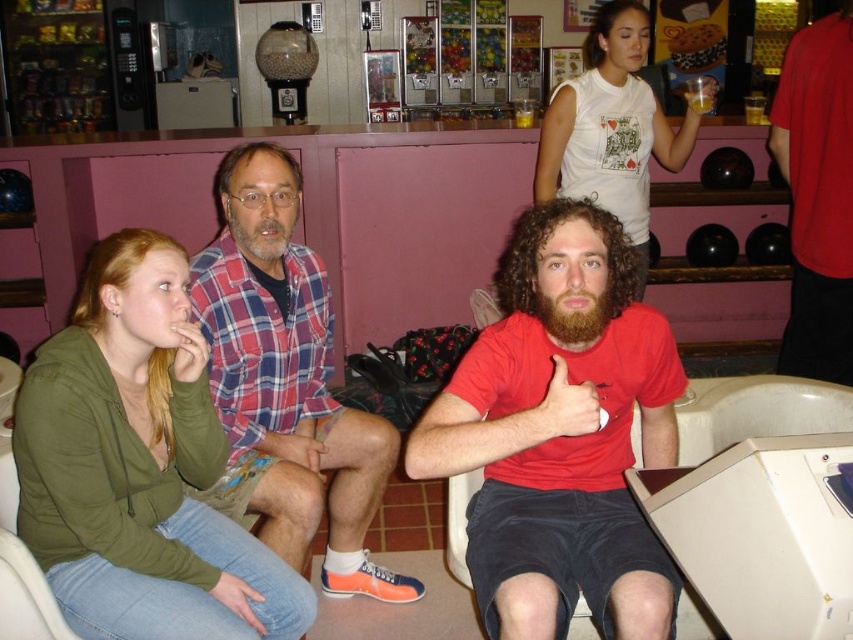
Which is more to the left, matte green hoodie at lower left or white cotton t-shirt at upper center?

matte green hoodie at lower left is more to the left.

Does matte green hoodie at lower left have a lesser height compared to white cotton t-shirt at upper center?

Correct, matte green hoodie at lower left is not as tall as white cotton t-shirt at upper center.

Between point (115, 296) and point (553, 182), which one is positioned behind?

Positioned behind is point (553, 182).

Identify the location of matte green hoodie at lower left. The height and width of the screenshot is (640, 853). (138, 467).

Who is more distant from viewer, (x=286, y=385) or (x=654, y=113)?

The point (x=654, y=113) is behind.

Between plaid shirt at center and white cotton t-shirt at upper center, which one is positioned lower?

plaid shirt at center

Find the location of a particular element. plaid shirt at center is located at coordinates (286, 384).

Looking at this image, can you confirm if red matte t-shirt at center is wider than matte green hoodie at lower left?

Yes, red matte t-shirt at center is wider than matte green hoodie at lower left.

In the scene shown: Does red matte t-shirt at center have a larger size compared to matte green hoodie at lower left?

Correct, red matte t-shirt at center is larger in size than matte green hoodie at lower left.

Where is `red matte t-shirt at center`? The height and width of the screenshot is (640, 853). red matte t-shirt at center is located at coordinates (561, 435).